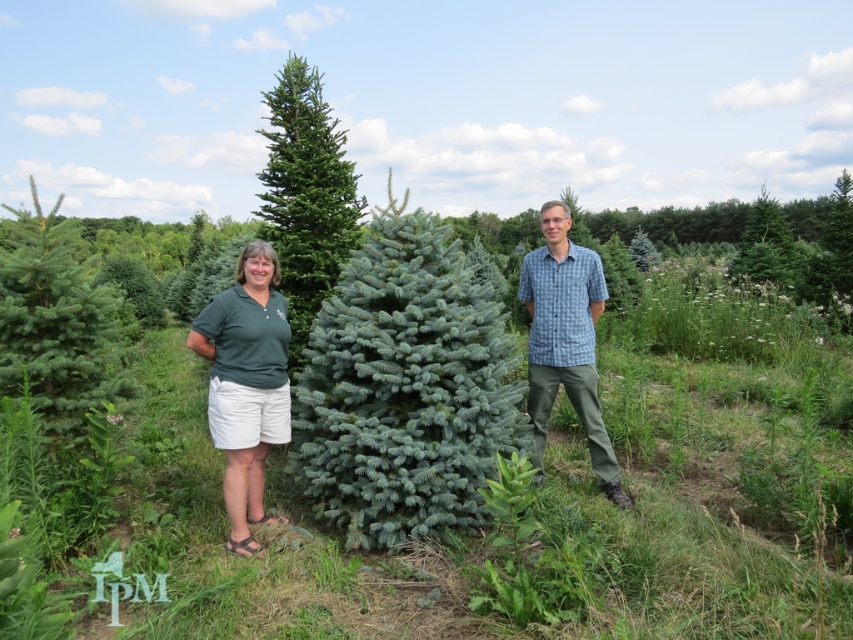
Question: Which point is closer to the camera taking this photo?

Choices:
 (A) (279, 220)
 (B) (254, 449)

Answer: (B)

Question: Which object appears farthest from the camera in this image?

Choices:
 (A) blue plaid shirt at center
 (B) blue-green needle-like at center
 (C) green fabric shirt at left
 (D) green needle-like at center

Answer: (D)

Question: Is blue-green needle-like at center further to camera compared to blue plaid shirt at center?

Choices:
 (A) no
 (B) yes

Answer: (A)

Question: Can you confirm if blue-green needle-like at center is thinner than green needle-like at center?

Choices:
 (A) yes
 (B) no

Answer: (A)

Question: Is green fabric shirt at left positioned behind blue plaid shirt at center?

Choices:
 (A) yes
 (B) no

Answer: (B)

Question: Which of the following is the closest to the observer?

Choices:
 (A) (540, 394)
 (B) (447, 394)
 (C) (323, 244)
 (D) (263, 378)

Answer: (B)